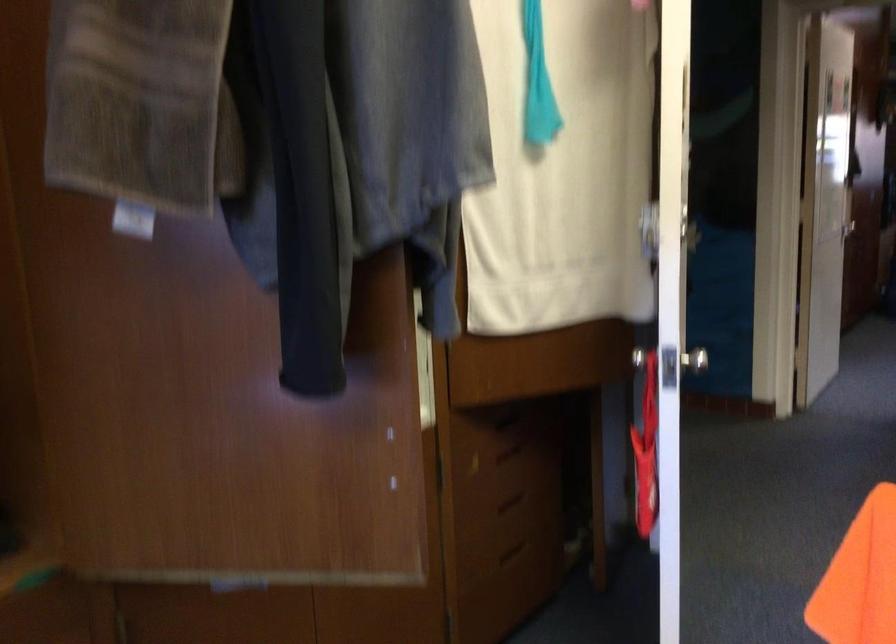
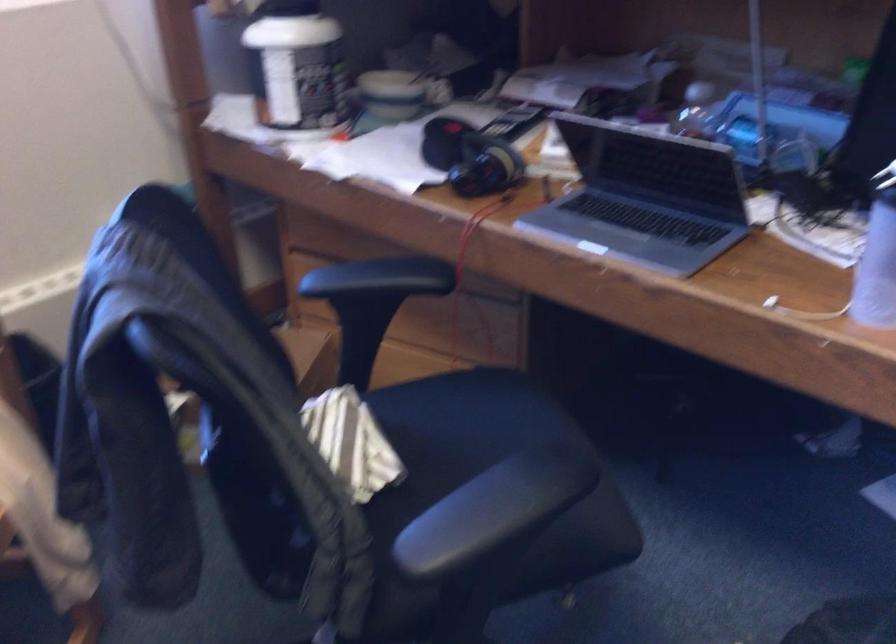
The first image is from the beginning of the video and the second image is from the end. How did the camera likely rotate when shooting the video?

The camera's rotation is toward left-down.